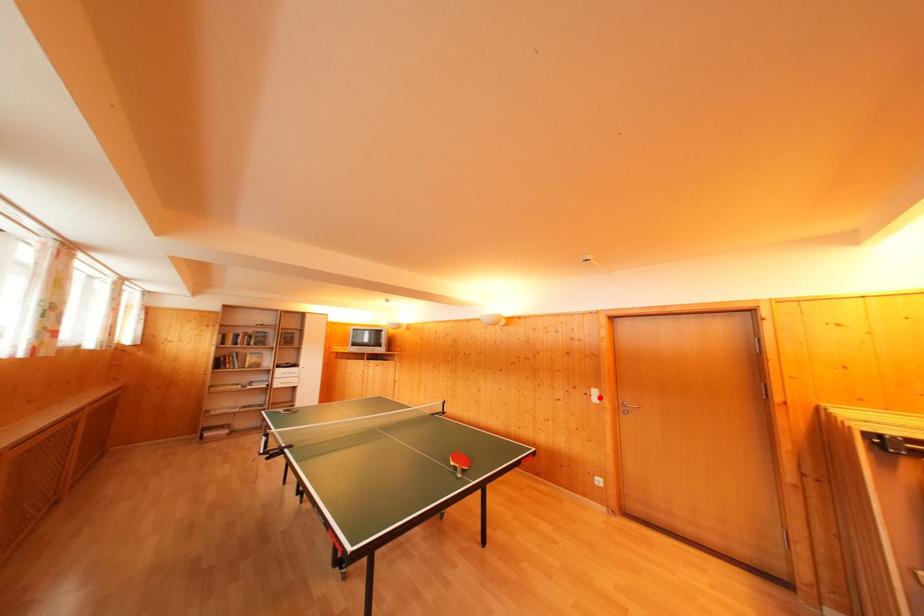
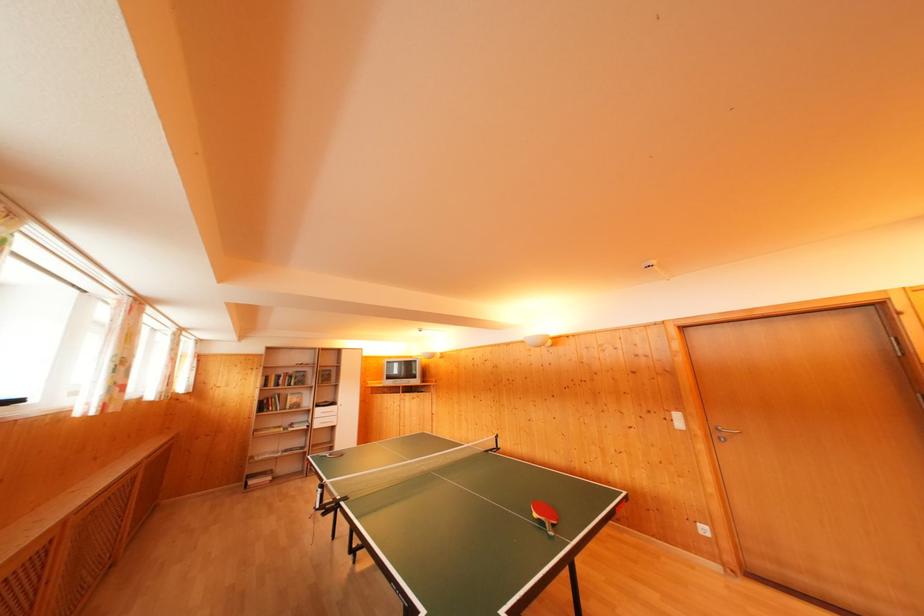
In the second image, find the point that corresponds to the highlighted location in the first image.

(682, 421)